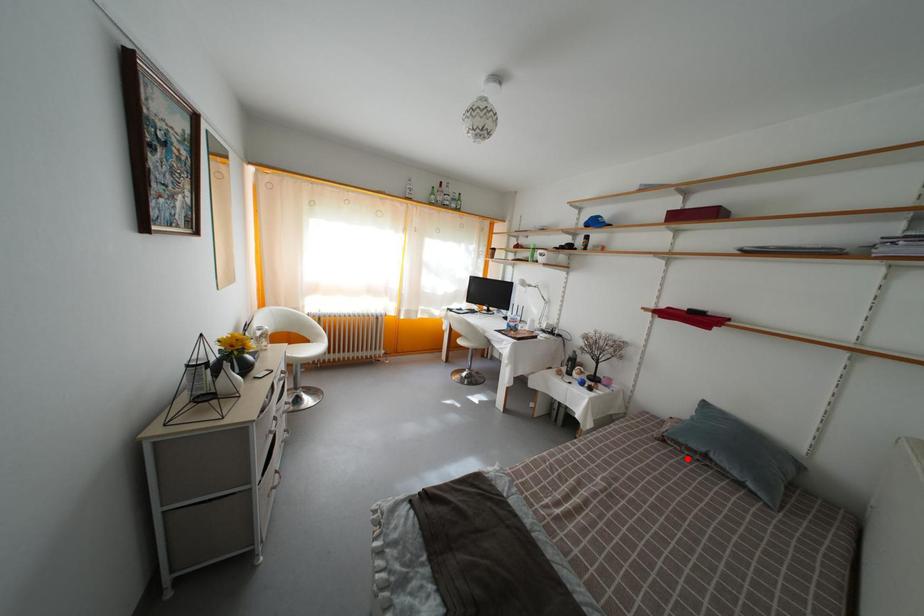
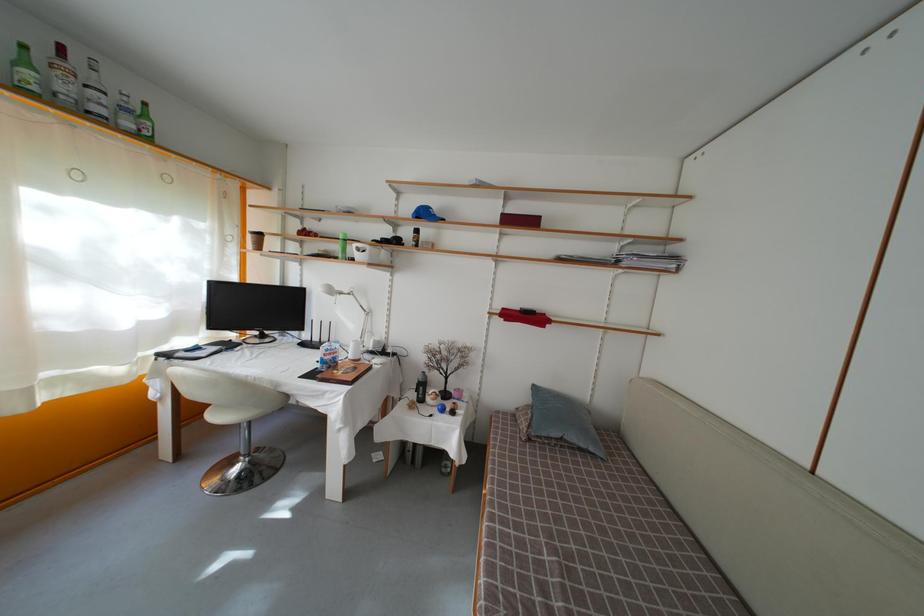
Question: I am providing you with two images of the same scene from different viewpoints. In image1, a red point is highlighted. Considering the same 3D point in image2, which of the following is correct?

Choices:
 (A) It is closer
 (B) It is farther

Answer: (B)